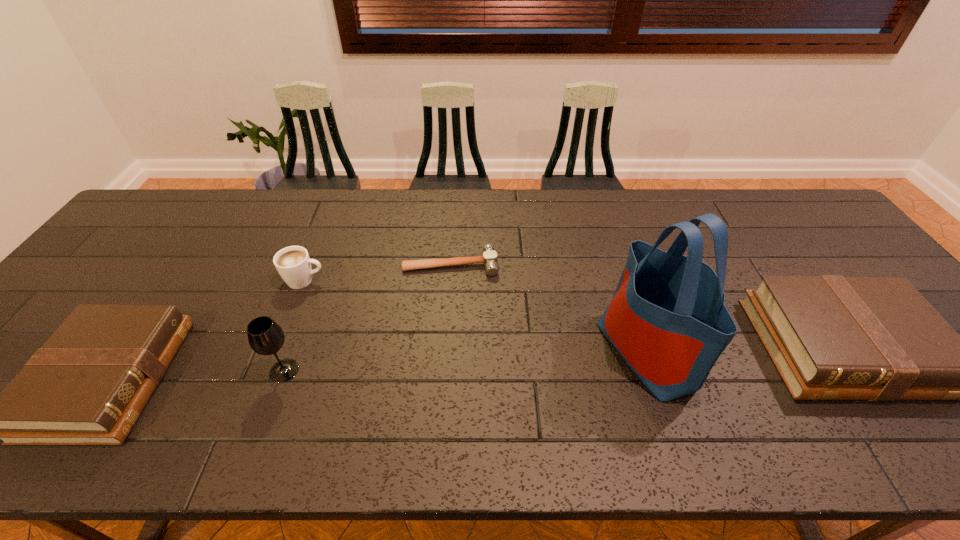
This screenshot has width=960, height=540. I want to click on the fifth closest object relative to the second object from right to left, so click(88, 384).

Image resolution: width=960 pixels, height=540 pixels. What are the coordinates of `object that is the fourth nearest to the cappuccino` in the screenshot? It's located at (667, 319).

Locate an element on the screen. The width and height of the screenshot is (960, 540). free location that satisfies the following two spatial constraints: 1. with the handle on the side of the cappuccino; 2. on the left side of the wineglass is located at coordinates (270, 370).

The height and width of the screenshot is (540, 960). I want to click on vacant space that satisfies the following two spatial constraints: 1. on the back side of the second tallest object; 2. on the left side of the handbag, so click(x=291, y=352).

Identify the location of vacant area that satisfies the following two spatial constraints: 1. with the handle on the side of the wineglass; 2. on the right side of the cappuccino. This screenshot has height=540, width=960. (270, 370).

Identify the location of free space that satisfies the following two spatial constraints: 1. on the front side of the tallest object; 2. on the spine side of the shorter Bible. (655, 379).

Identify the location of blank area in the image that satisfies the following two spatial constraints: 1. with the handle on the side of the cappuccino; 2. on the back side of the tallest object. (276, 352).